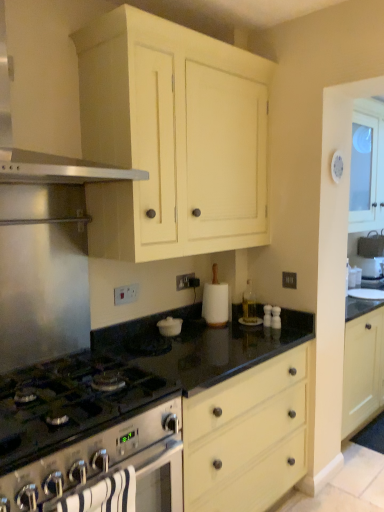
The image size is (384, 512). What are the coordinates of `satin silver oven at lower left` in the screenshot? It's located at (107, 464).

This screenshot has height=512, width=384. Identify the location of black granite countertop at center. (162, 415).

What is the approximate height of satin silver gas stove at lower left?

satin silver gas stove at lower left is 7.71 inches in height.

Locate an element on the screen. Image resolution: width=384 pixels, height=512 pixels. satin silver range hood at upper left is located at coordinates (46, 95).

Is black granite countertop at center at the back of satin silver range hood at upper left?

No.

I want to click on countertop below the satin silver range hood at upper left (from a real-world perspective), so click(162, 415).

Considering the relative positions of satin silver range hood at upper left and black granite countertop at center in the image provided, is satin silver range hood at upper left to the left of black granite countertop at center from the viewer's perspective?

Yes, satin silver range hood at upper left is to the left of black granite countertop at center.

Is black granite countertop at center oriented away from satin silver gas stove at lower left?

black granite countertop at center does not have its back to satin silver gas stove at lower left.

Does black granite countertop at center have a lesser height compared to satin silver gas stove at lower left?

In fact, black granite countertop at center may be taller than satin silver gas stove at lower left.

Can you confirm if black granite countertop at center is thinner than satin silver gas stove at lower left?

Yes, black granite countertop at center is thinner than satin silver gas stove at lower left.

Considering their positions, is black granite countertop at center located in front of or behind satin silver gas stove at lower left?

In the image, black granite countertop at center appears behind satin silver gas stove at lower left.

From the picture: Is satin silver gas stove at lower left wider than black granite countertop at center?

Yes.

Considering the positions of points (26, 448) and (298, 356), is point (26, 448) farther from camera compared to point (298, 356)?

No, it is in front of (298, 356).

Is black granite countertop at center surrounded by satin silver gas stove at lower left?

No, black granite countertop at center is not inside satin silver gas stove at lower left.

Does satin silver gas stove at lower left turn towards black granite countertop at center?

No, satin silver gas stove at lower left is not turned towards black granite countertop at center.

Considering the points (86, 98) and (6, 425), which point is in front, point (86, 98) or point (6, 425)?

The point (6, 425) is more forward.

How far apart are matte cream cabinet at upper center and satin silver gas stove at lower left?

matte cream cabinet at upper center is 33.75 inches from satin silver gas stove at lower left.

Could you tell me if matte cream cabinet at upper center is turned towards satin silver gas stove at lower left?

No, matte cream cabinet at upper center is not oriented towards satin silver gas stove at lower left.

In the scene shown: In terms of size, does matte cream cabinet at upper center appear bigger or smaller than satin silver gas stove at lower left?

Clearly, matte cream cabinet at upper center is larger in size than satin silver gas stove at lower left.

Considering the relative positions of black granite countertop at center and clear glass bottle at center in the image provided, is black granite countertop at center in front of clear glass bottle at center?

That is True.

Can you see black granite countertop at center touching clear glass bottle at center?

They are not placed beside each other.

From the picture: Is black granite countertop at center positioned with its back to clear glass bottle at center?

black granite countertop at center is not turned away from clear glass bottle at center.

From the image's perspective, which object appears higher, matte cream cabinet at upper center or satin silver range hood at upper left?

satin silver range hood at upper left appears higher in the image.

Does matte cream cabinet at upper center have a larger size compared to satin silver range hood at upper left?

Indeed, matte cream cabinet at upper center has a larger size compared to satin silver range hood at upper left.

Between matte cream cabinet at upper center and satin silver range hood at upper left, which one has more height?

Standing taller between the two is matte cream cabinet at upper center.

The width and height of the screenshot is (384, 512). In order to click on cabinetry lying on the right of satin silver range hood at upper left in this screenshot , I will do `click(172, 138)`.

From the image's perspective, between clear glass bottle at center and matte cream cabinet at upper center, who is located below?

clear glass bottle at center.

Can matte cream cabinet at upper center be found inside clear glass bottle at center?

Actually, matte cream cabinet at upper center is outside clear glass bottle at center.

Is clear glass bottle at center positioned with its back to matte cream cabinet at upper center?

No, clear glass bottle at center's orientation is not away from matte cream cabinet at upper center.

In the image, there is a black granite countertop at center. At what (x,y) coordinates should I click in order to perform the action: click on kitchen appliance above it (from the image's perspective). Please return your answer as a coordinate pair (x, y). The width and height of the screenshot is (384, 512). Looking at the image, I should click on (46, 95).

Where is `countertop behind the satin silver gas stove at lower left`? Image resolution: width=384 pixels, height=512 pixels. countertop behind the satin silver gas stove at lower left is located at coordinates tap(162, 415).

Which object lies further to the anchor point satin silver range hood at upper left, matte cream cabinet at upper center or clear glass bottle at center?

The object further to satin silver range hood at upper left is clear glass bottle at center.

Based on their spatial positions, is matte cream cabinet at upper center or clear glass bottle at center further from black granite countertop at center?

Based on the image, matte cream cabinet at upper center appears to be further to black granite countertop at center.

Looking at the image, which one is located further to matte cream cabinet at upper center, black granite countertop at center or satin silver oven at lower left?

satin silver oven at lower left is further to matte cream cabinet at upper center.

When comparing their distances from matte cream cabinet at upper center, does black granite countertop at center or satin silver range hood at upper left seem further?

The object further to matte cream cabinet at upper center is black granite countertop at center.

When comparing their distances from satin silver oven at lower left, does satin silver range hood at upper left or clear glass bottle at center seem further?

Among the two, clear glass bottle at center is located further to satin silver oven at lower left.

When comparing their distances from clear glass bottle at center, does matte cream cabinet at upper center or black granite countertop at center seem closer?

Among the two, black granite countertop at center is located nearer to clear glass bottle at center.

Looking at the image, which one is located closer to matte cream cabinet at upper center, black granite countertop at center or clear glass bottle at center?

black granite countertop at center lies closer to matte cream cabinet at upper center than the other object.

When comparing their distances from matte cream cabinet at upper center, does satin silver range hood at upper left or satin silver gas stove at lower left seem further?

satin silver gas stove at lower left is positioned further to the anchor matte cream cabinet at upper center.

At what (x,y) coordinates should I click in order to perform the action: click on countertop between satin silver gas stove at lower left and clear glass bottle at center along the z-axis. Please return your answer as a coordinate pair (x, y). Image resolution: width=384 pixels, height=512 pixels. Looking at the image, I should click on (162, 415).

This screenshot has height=512, width=384. In order to click on oven located between satin silver gas stove at lower left and clear glass bottle at center in the depth direction in this screenshot , I will do `click(107, 464)`.

This screenshot has width=384, height=512. In order to click on gas stove between satin silver range hood at upper left and satin silver oven at lower left in the up-down direction in this screenshot , I will do `click(70, 403)`.

You are a GUI agent. You are given a task and a screenshot of the screen. Output one action in this format:
    pyautogui.click(x=<x>, y=<y>)
    Task: Click on the cabinetry between satin silver range hood at upper left and satin silver oven at lower left from top to bottom
    The height and width of the screenshot is (512, 384).
    Given the screenshot: What is the action you would take?
    pyautogui.click(x=172, y=138)